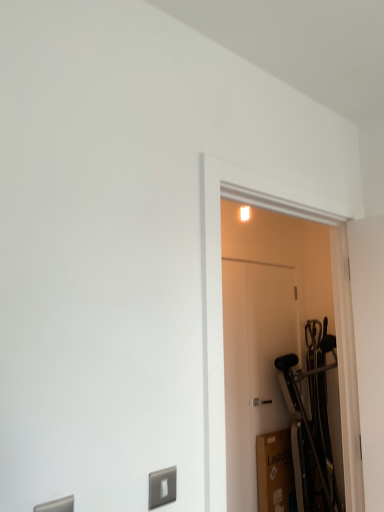
Question: Is white matte door at center, the 2th door viewed from the front, taller or shorter than white matte door at center, acting as the second door starting from the back?

Choices:
 (A) short
 (B) tall

Answer: (B)

Question: In the image, is white matte door at center, the 2th door viewed from the front, positioned in front of or behind white matte door at center, acting as the second door starting from the back?

Choices:
 (A) behind
 (B) front

Answer: (A)

Question: From the image's perspective, is white matte door at center, the first door viewed from the back, positioned above or below white matte door at center, acting as the second door starting from the back?

Choices:
 (A) below
 (B) above

Answer: (A)

Question: Is white matte door at center, acting as the first door starting from the front, wider or thinner than white matte door at center, the first door viewed from the back?

Choices:
 (A) thin
 (B) wide

Answer: (B)

Question: From a real-world perspective, is white matte door at center, acting as the second door starting from the back, positioned above or below white matte door at center, the first door viewed from the back?

Choices:
 (A) below
 (B) above

Answer: (B)

Question: Considering their positions, is white matte door at center, acting as the second door starting from the back, located in front of or behind white matte door at center, the first door viewed from the back?

Choices:
 (A) behind
 (B) front

Answer: (B)

Question: Considering the positions of point (289, 417) and point (226, 480), is point (289, 417) closer or farther from the camera than point (226, 480)?

Choices:
 (A) closer
 (B) farther

Answer: (B)